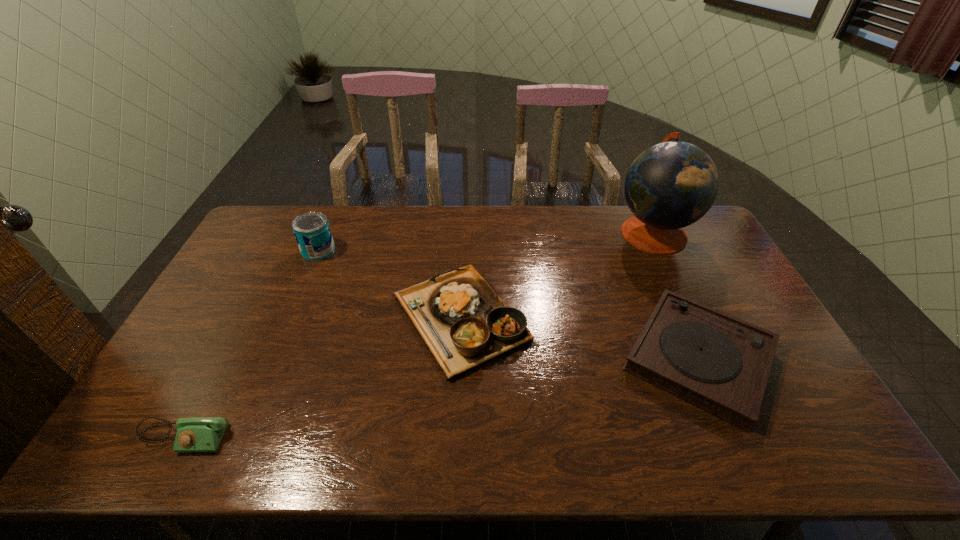
Where is `globe`? globe is located at coordinates (671, 185).

You are a GUI agent. You are given a task and a screenshot of the screen. Output one action in this format:
    pyautogui.click(x=<x>, y=<y>)
    Task: Click on the can
    The height and width of the screenshot is (540, 960).
    Given the screenshot: What is the action you would take?
    pyautogui.click(x=312, y=231)

Locate an element on the screen. The width and height of the screenshot is (960, 540). the third object from right to left is located at coordinates (465, 324).

Where is `the third tallest object`? This screenshot has width=960, height=540. the third tallest object is located at coordinates [465, 324].

This screenshot has width=960, height=540. In order to click on phonograph record in this screenshot , I will do `click(716, 362)`.

You are a GUI agent. You are given a task and a screenshot of the screen. Output one action in this format:
    pyautogui.click(x=<x>, y=<y>)
    Task: Click on the telephone
    The height and width of the screenshot is (540, 960).
    Given the screenshot: What is the action you would take?
    pyautogui.click(x=193, y=434)

The image size is (960, 540). Find the location of `free space located 0.220m with the Americas facing the viewer on the globe`. free space located 0.220m with the Americas facing the viewer on the globe is located at coordinates (554, 232).

The width and height of the screenshot is (960, 540). I want to click on free region located 0.340m with the Americas facing the viewer on the globe, so click(x=521, y=232).

You are a GUI agent. You are given a task and a screenshot of the screen. Output one action in this format:
    pyautogui.click(x=<x>, y=<y>)
    Task: Click on the free space located with the Americas facing the viewer on the globe
    
    Given the screenshot: What is the action you would take?
    pos(510,232)

Identify the location of vacant area situated on the right of the can. This screenshot has height=540, width=960. (397, 250).